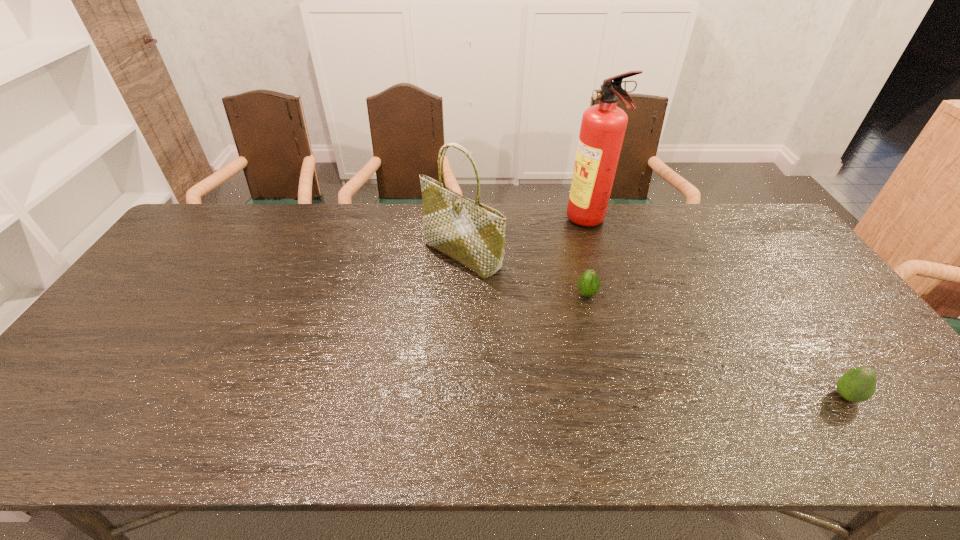
This screenshot has width=960, height=540. Find the location of `free spot between the farther avocado and the leftmost object`. free spot between the farther avocado and the leftmost object is located at coordinates [524, 275].

The image size is (960, 540). In order to click on vacant point located between the fire extinguisher and the shopping bag in this screenshot , I will do `click(525, 239)`.

Locate an element on the screen. The width and height of the screenshot is (960, 540). the third closest object relative to the fire extinguisher is located at coordinates (858, 384).

Identify which object is the second nearest to the left avocado. Please provide its 2D coordinates. Your answer should be formatted as a tuple, i.e. [(x, y)], where the tuple contains the x and y coordinates of a point satisfying the conditions above.

[(603, 126)]

Locate an element on the screen. free spot that satisfies the following two spatial constraints: 1. on the front side of the shopping bag; 2. on the right side of the nearer avocado is located at coordinates (456, 396).

At what (x,y) coordinates should I click in order to perform the action: click on vacant space that satisfies the following two spatial constraints: 1. on the front-facing side of the nearest object; 2. on the left side of the fire extinguisher. Please return your answer as a coordinate pair (x, y). Looking at the image, I should click on (640, 396).